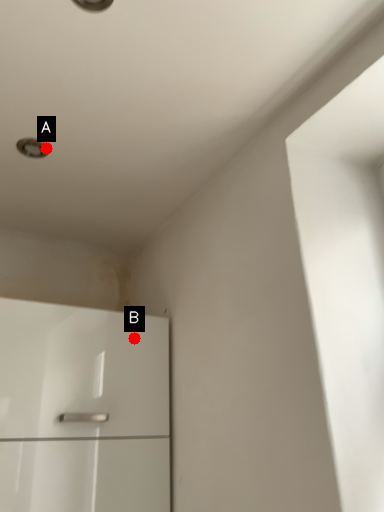
Question: Two points are circled on the image, labeled by A and B beside each circle. Which of the following is the farthest from the observer?

Choices:
 (A) A is further
 (B) B is further

Answer: (B)